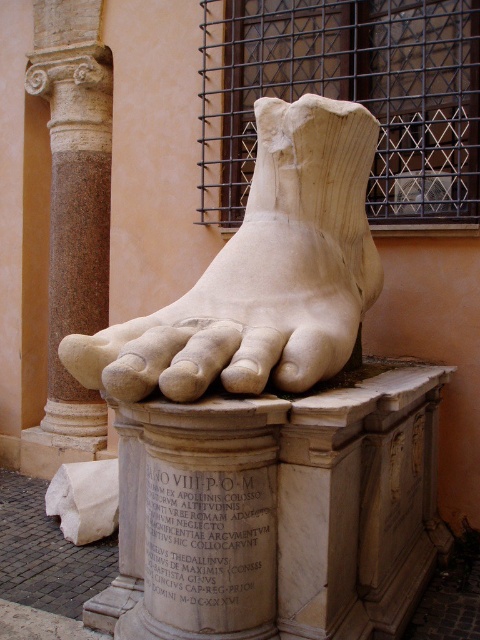
You are an archaeologist examining the ancient stone sculpture. You notice two points marked on the image. The first point is at coordinates point (267, 204) and the second is at point (38, 8). Based on your observation, which point is nearer to you as you stand in front of the sculpture?

Point (267, 204) is closer to the camera than point (38, 8), so the first point is nearer to you.

You are an art conservator examining the sculpture. You notice a small point marked at coordinates (263, 273). Based on the description, where exactly is this point located on the sculpture?

The point at coordinates (263, 273) is located on the white marble foot at center of the sculpture.

In the scene shown: You are an art conservator examining the sculpture. You need to clean the white marble foot at center and the granite column at left. Which object should you clean first if you want to start with the one closer to you?

The white marble foot at center is in front of the granite column at left, so you should clean the white marble foot at center first since it is closer to you.